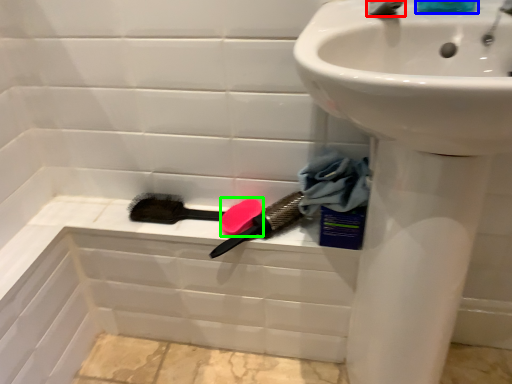
Question: Considering the real-world distances, which object is closest to tap (highlighted by a red box)? liquid (highlighted by a blue box) or soap (highlighted by a green box).

Choices:
 (A) liquid
 (B) soap

Answer: (A)